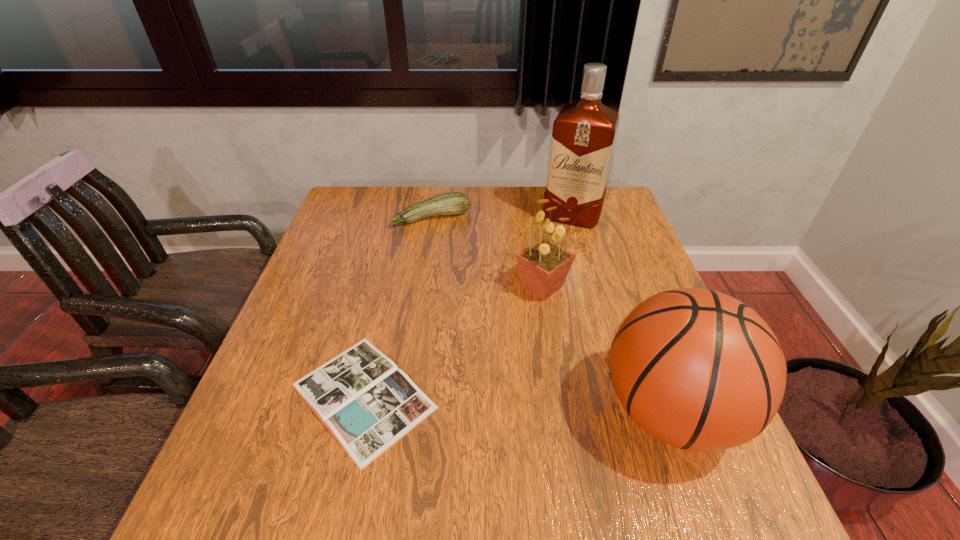
Where is `the shortest object`? The height and width of the screenshot is (540, 960). the shortest object is located at coordinates (367, 403).

Identify the location of basketball. (697, 369).

Where is `the second shortest object`? the second shortest object is located at coordinates (453, 203).

Identify the location of liquor. The width and height of the screenshot is (960, 540). (583, 137).

The width and height of the screenshot is (960, 540). In order to click on the third nearest object in this screenshot , I will do tap(544, 265).

Where is `blank space located 0.190m on the back of the shortest object`? blank space located 0.190m on the back of the shortest object is located at coordinates (390, 282).

Image resolution: width=960 pixels, height=540 pixels. What are the coordinates of `free space located on the back of the basketball` in the screenshot? It's located at (625, 289).

Where is `free space located 0.180m at the stem end of the second shortest object`? free space located 0.180m at the stem end of the second shortest object is located at coordinates (462, 265).

Locate an element on the screen. The width and height of the screenshot is (960, 540). vacant space located at the stem end of the second shortest object is located at coordinates (454, 251).

You are a GUI agent. You are given a task and a screenshot of the screen. Output one action in this format:
    pyautogui.click(x=<x>, y=<y>)
    Task: Click on the free location located 0.370m at the stem end of the second shortest object
    
    Given the screenshot: What is the action you would take?
    click(486, 312)